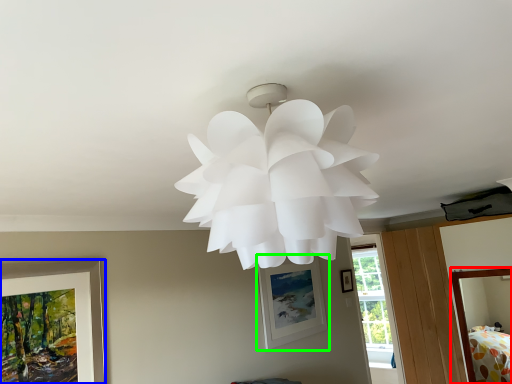
Question: Which object is the farthest from bed (highlighted by a red box)? Choose among these: picture frame (highlighted by a blue box) or picture frame (highlighted by a green box).

Choices:
 (A) picture frame
 (B) picture frame

Answer: (A)